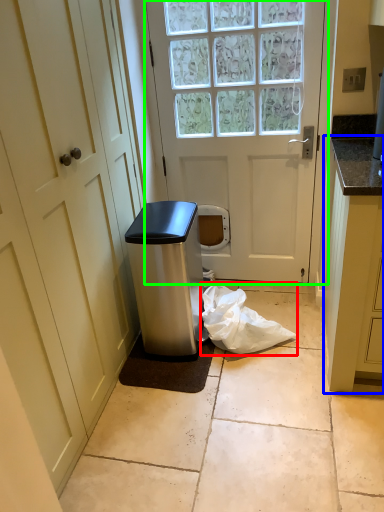
Question: Which object is positioned farthest from plastic bag (highlighted by a red box)? Select from cabinetry (highlighted by a blue box) and door (highlighted by a green box).

Choices:
 (A) cabinetry
 (B) door

Answer: (B)